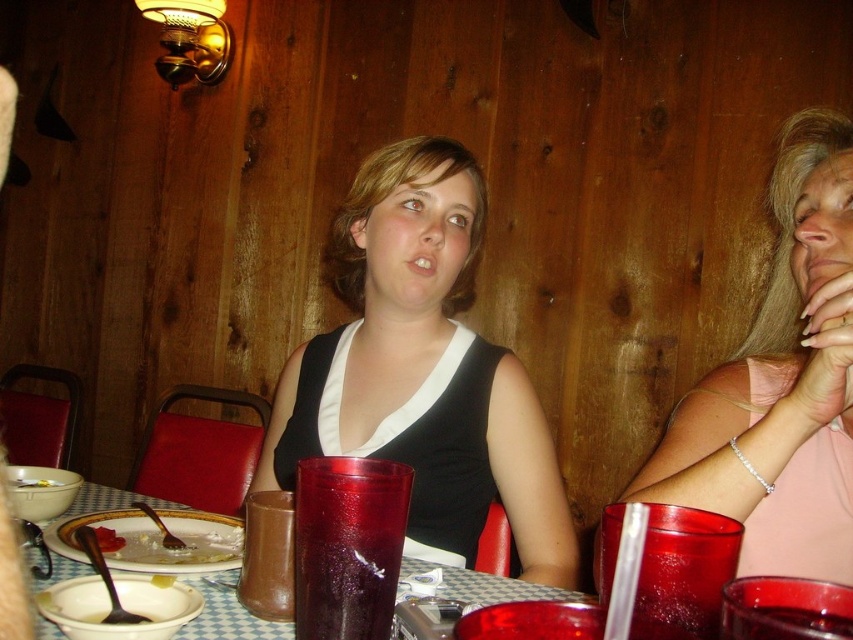
Which is more to the right, matte black tank top at center or pink fabric shirt at upper right?

From the viewer's perspective, pink fabric shirt at upper right appears more on the right side.

Measure the distance between matte black tank top at center and pink fabric shirt at upper right.

The distance of matte black tank top at center from pink fabric shirt at upper right is 17.07 inches.

Is point (343, 406) farther from viewer compared to point (738, 371)?

Yes, point (343, 406) is farther from viewer.

At what (x,y) coordinates should I click in order to perform the action: click on matte black tank top at center. Please return your answer as a coordinate pair (x, y). The width and height of the screenshot is (853, 640). Looking at the image, I should click on (422, 369).

Between matte black tank top at center and translucent plastic cup at center, which one appears on the left side from the viewer's perspective?

translucent plastic cup at center

Can you confirm if matte black tank top at center is wider than translucent plastic cup at center?

Yes.

This screenshot has width=853, height=640. What do you see at coordinates (422, 369) in the screenshot? I see `matte black tank top at center` at bounding box center [422, 369].

Find the location of `matte black tank top at center`. matte black tank top at center is located at coordinates (422, 369).

Is point (73, 541) closer to camera compared to point (274, 490)?

No, it is behind (274, 490).

Between point (144, 525) and point (264, 561), which one is positioned in front?

Point (264, 561)

This screenshot has width=853, height=640. In order to click on white creamy soup at lower left in this screenshot , I will do `click(155, 540)`.